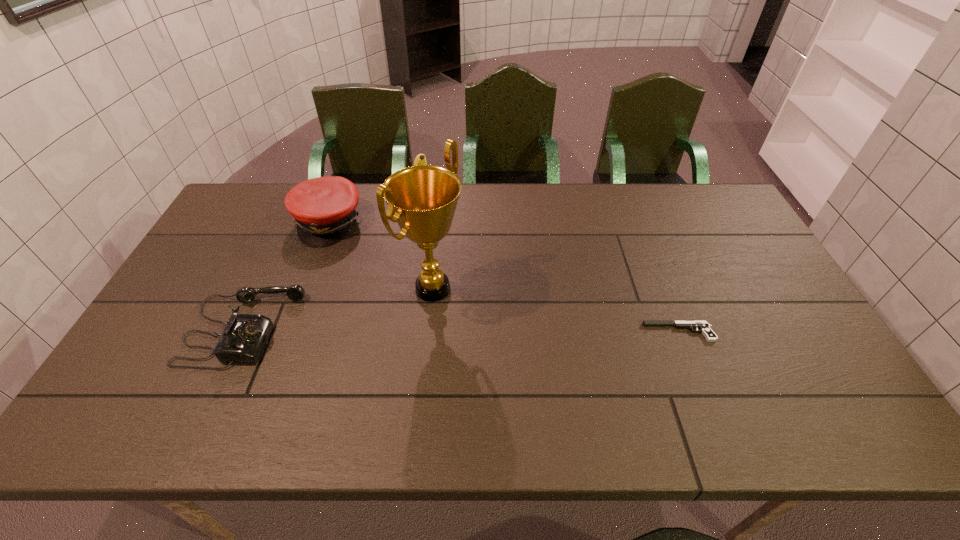
The height and width of the screenshot is (540, 960). In order to click on free space between the telephone and the cap in this screenshot , I will do `click(286, 275)`.

At what (x,y) coordinates should I click in order to perform the action: click on free spot between the cap and the fourth shortest object. Please return your answer as a coordinate pair (x, y). Looking at the image, I should click on (376, 211).

Image resolution: width=960 pixels, height=540 pixels. In order to click on free space between the cap and the tallest object in this screenshot , I will do `click(381, 255)`.

Image resolution: width=960 pixels, height=540 pixels. Find the location of `unoccupied position between the cap and the telephone`. unoccupied position between the cap and the telephone is located at coordinates tap(286, 275).

At what (x,y) coordinates should I click in order to perform the action: click on vacant space that's between the pistol and the telephone. Please return your answer as a coordinate pair (x, y). The height and width of the screenshot is (540, 960). Looking at the image, I should click on pyautogui.click(x=461, y=330).

At what (x,y) coordinates should I click in order to perform the action: click on free point between the shortest object and the telephone. Please return your answer as a coordinate pair (x, y). The image size is (960, 540). Looking at the image, I should click on (461, 330).

Identify the location of free space between the cap and the fourth shortest object. The width and height of the screenshot is (960, 540). (376, 211).

At what (x,y) coordinates should I click in order to perform the action: click on free space between the rightmost object and the award. Please return your answer as a coordinate pair (x, y). Looking at the image, I should click on click(556, 310).

Select which object appears as the fourth closest to the rightmost object. Please provide its 2D coordinates. Your answer should be formatted as a tuple, i.e. [(x, y)], where the tuple contains the x and y coordinates of a point satisfying the conditions above.

[(244, 337)]

The height and width of the screenshot is (540, 960). Identify the location of object identified as the fourth closest to the shortest object. (244, 337).